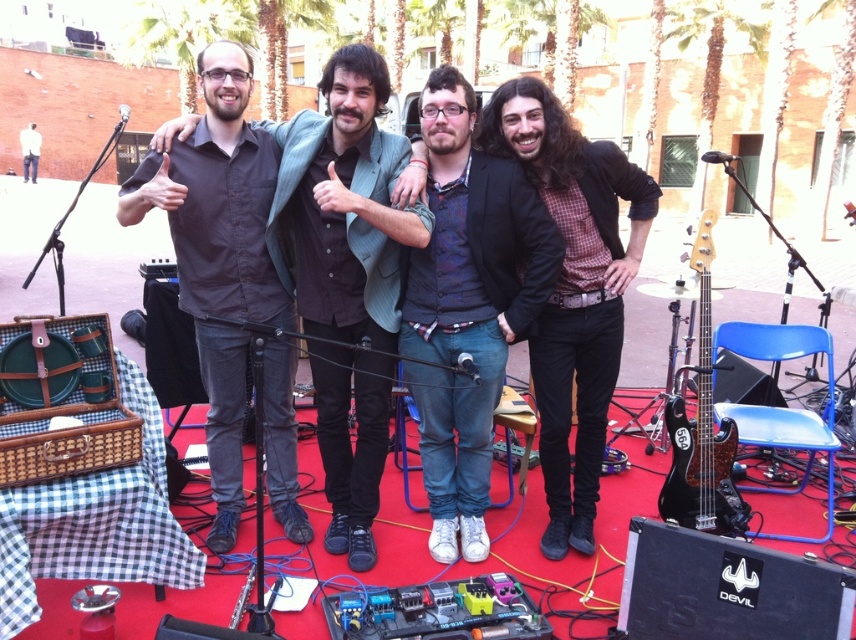
Question: Which is farther from the matte black shirt at center?

Choices:
 (A) black glossy bass guitar at right
 (B) denim jeans at center

Answer: (A)

Question: Is denim jeans at center smaller than black glossy bass guitar at right?

Choices:
 (A) yes
 (B) no

Answer: (A)

Question: Among these objects, which one is nearest to the camera?

Choices:
 (A) black glossy bass guitar at right
 (B) matte black shirt at center
 (C) denim jeans at center

Answer: (B)

Question: Is matte black shirt at center to the left of black glossy bass guitar at right from the viewer's perspective?

Choices:
 (A) yes
 (B) no

Answer: (A)

Question: Is denim jeans at center below black glossy bass guitar at right?

Choices:
 (A) yes
 (B) no

Answer: (B)

Question: Which object appears closest to the camera in this image?

Choices:
 (A) denim jeans at center
 (B) black glossy bass guitar at right
 (C) matte black shirt at center

Answer: (C)